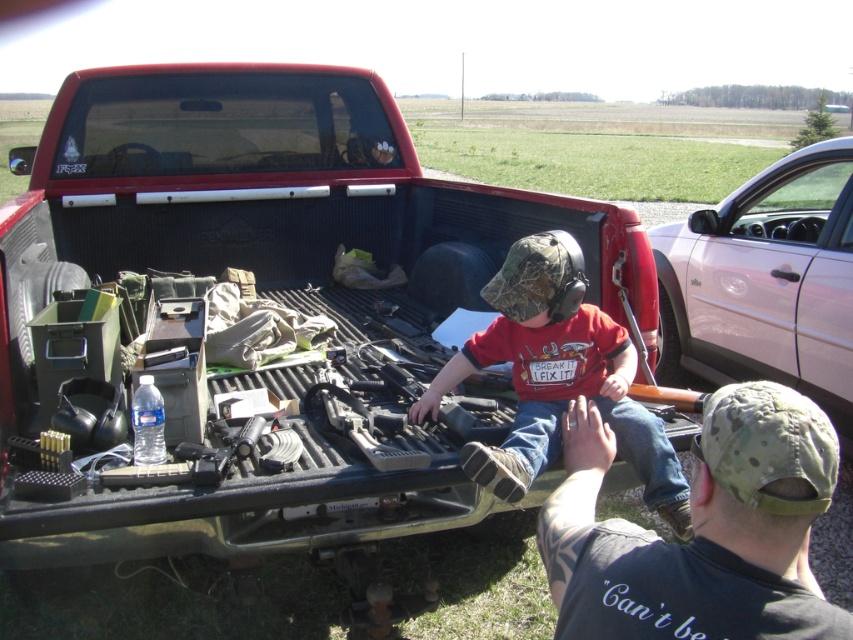
Question: Can you confirm if camouflage fabric cap at upper right is positioned to the left of camouflage fabric shirt at center?

Choices:
 (A) no
 (B) yes

Answer: (A)

Question: Which point appears closest to the camera in this image?

Choices:
 (A) (793, 429)
 (B) (846, 380)

Answer: (A)

Question: Which point appears closest to the camera in this image?

Choices:
 (A) (548, 532)
 (B) (573, 380)
 (C) (833, 225)

Answer: (A)

Question: Is metallic silver car at right bigger than camouflage fabric shirt at center?

Choices:
 (A) yes
 (B) no

Answer: (A)

Question: Can you confirm if camouflage fabric cap at upper right is positioned above camouflage fabric shirt at center?

Choices:
 (A) yes
 (B) no

Answer: (B)

Question: Which object is positioned closest to the camouflage fabric shirt at center?

Choices:
 (A) camouflage fabric cap at upper right
 (B) metallic silver car at right

Answer: (A)